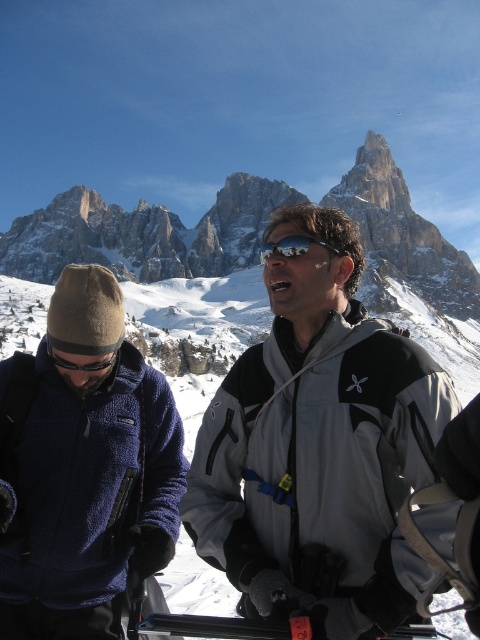
What do you see at coordinates (319, 445) in the screenshot?
I see `gray/synthetic jacket at center` at bounding box center [319, 445].

Is gray/synthetic jacket at center positioned behind black reflective goggles at left?

No, it is not.

Between point (324, 408) and point (62, 368), which one is positioned behind?

The point (62, 368) is behind.

Where is `gray/synthetic jacket at center`? This screenshot has width=480, height=640. gray/synthetic jacket at center is located at coordinates (319, 445).

Is snowy rocky peak at upper center further to camera compared to black reflective goggles at left?

Yes, snowy rocky peak at upper center is behind black reflective goggles at left.

Is snowy rocky peak at upper center shorter than black reflective goggles at left?

No.

Between point (228, 237) and point (52, 356), which one is positioned behind?

The point (228, 237) is more distant.

Locate an element on the screen. This screenshot has height=640, width=480. snowy rocky peak at upper center is located at coordinates (144, 234).

Is blue fleece jacket at left positioned before snowy rocky peak at upper center?

Yes, it is in front of snowy rocky peak at upper center.

Is the position of blue fleece jacket at left more distant than that of snowy rocky peak at upper center?

No.

Between point (25, 547) and point (99, 256), which one is positioned in front?

Positioned in front is point (25, 547).

Locate an element on the screen. The width and height of the screenshot is (480, 640). blue fleece jacket at left is located at coordinates point(84,468).